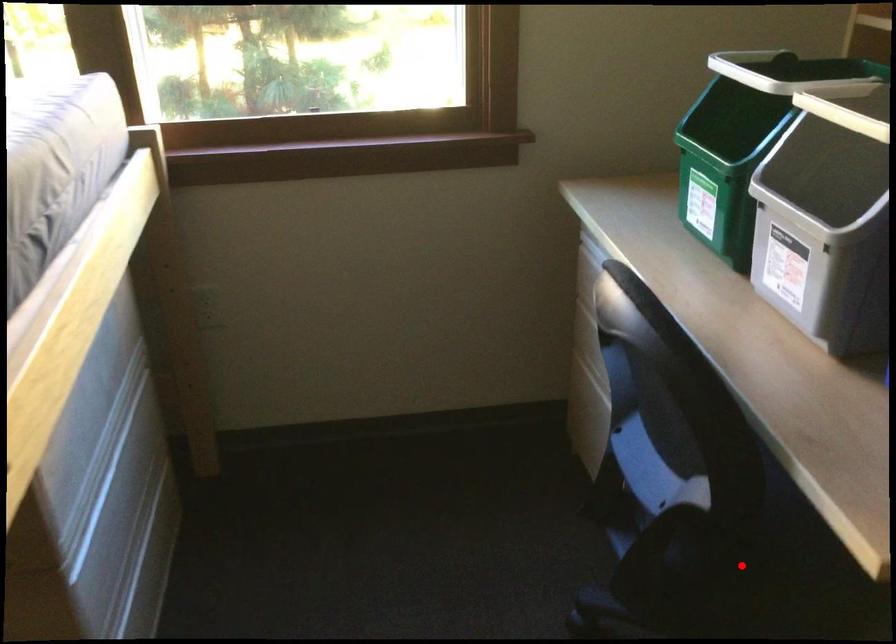
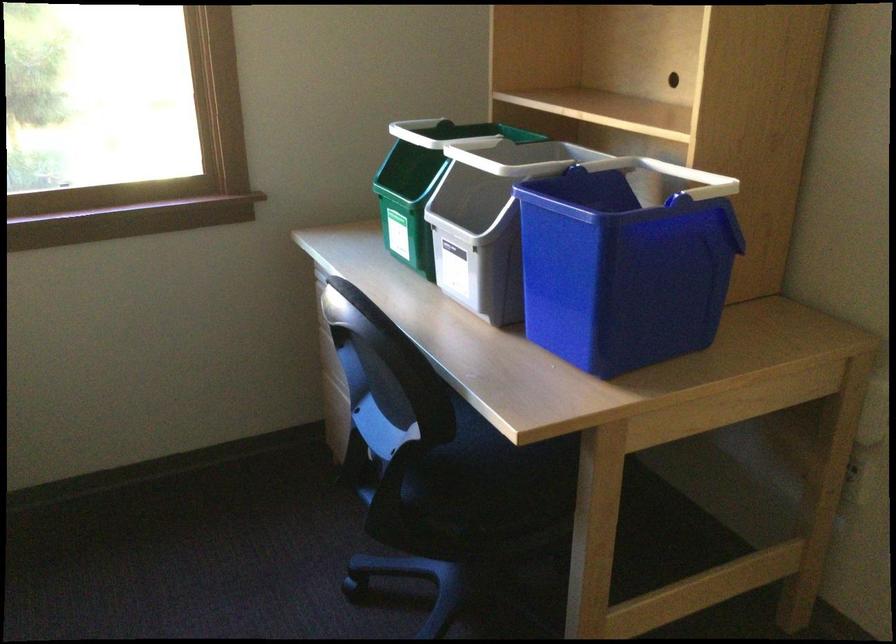
Question: I am providing you with two images of the same scene from different viewpoints. Image1 has a red point marked. In image2, the corresponding 3D location appears at what relative position? Reply with the corresponding letter.

Choices:
 (A) Closer
 (B) Farther

Answer: (B)